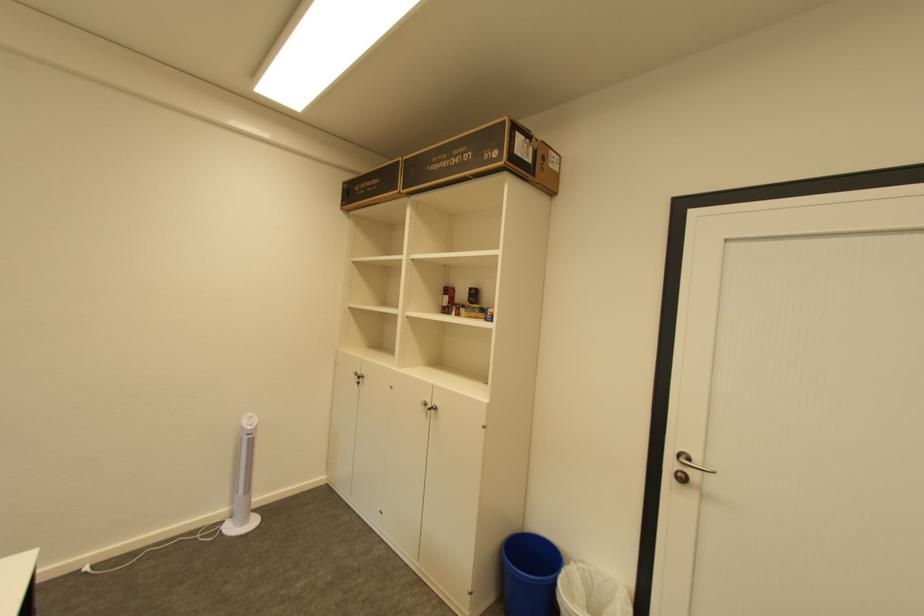
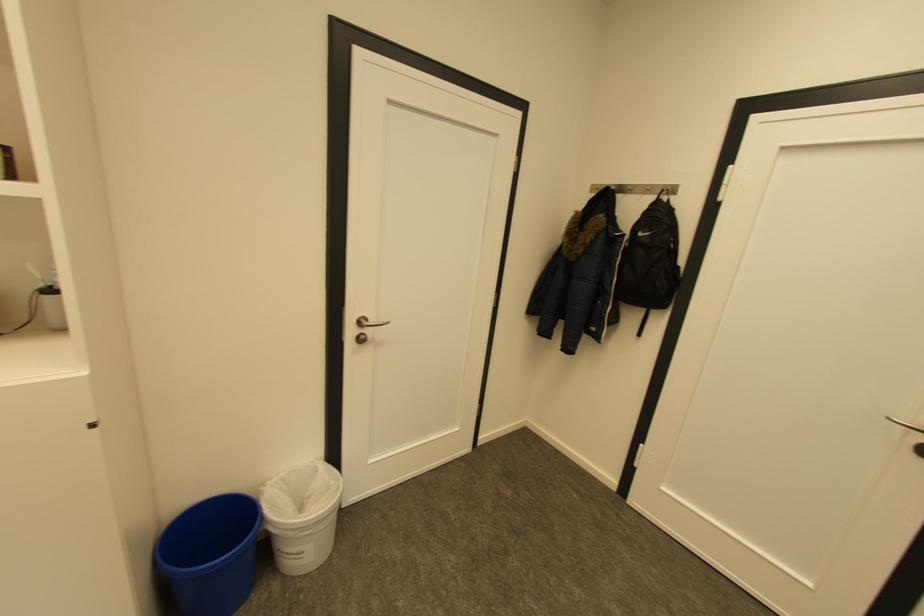
How did the camera likely rotate?

The camera's rotation is toward right-down.